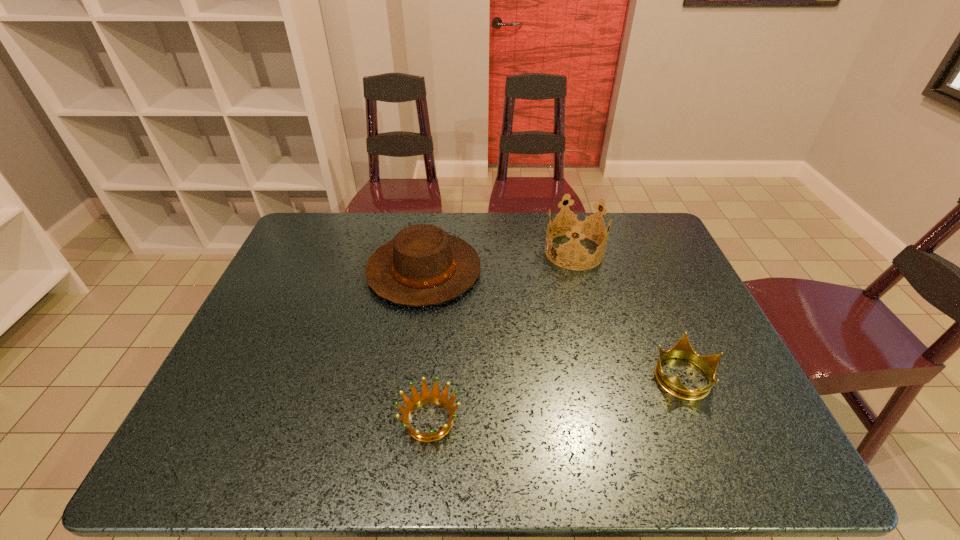
Find the location of a particular element. The width and height of the screenshot is (960, 540). vacant space located 0.290m on the back of the shortest object is located at coordinates (x=441, y=305).

At what (x,y) coordinates should I click in order to perform the action: click on crown situated at the far edge. Please return your answer as a coordinate pair (x, y). Looking at the image, I should click on (578, 226).

Identify the location of cowboy hat present at the far edge. (422, 266).

The image size is (960, 540). I want to click on object that is at the near edge, so click(x=426, y=397).

You are a GUI agent. You are given a task and a screenshot of the screen. Output one action in this format:
    pyautogui.click(x=<x>, y=<y>)
    Task: Click on the object at the right edge
    
    Given the screenshot: What is the action you would take?
    pyautogui.click(x=682, y=349)

In the image, there is a desktop. Find the location of `vacant space at the far edge`. vacant space at the far edge is located at coordinates (384, 217).

The width and height of the screenshot is (960, 540). I want to click on vacant space at the near edge of the desktop, so click(x=689, y=456).

The width and height of the screenshot is (960, 540). Identify the location of vacant space at the left edge of the desktop. (310, 320).

This screenshot has height=540, width=960. In the image, there is a desktop. In order to click on vacant space at the right edge in this screenshot , I will do `click(691, 370)`.

At what (x,y) coordinates should I click in order to perform the action: click on vacant space at the far left corner of the desktop. Please return your answer as a coordinate pair (x, y). The image size is (960, 540). Looking at the image, I should click on pos(317,230).